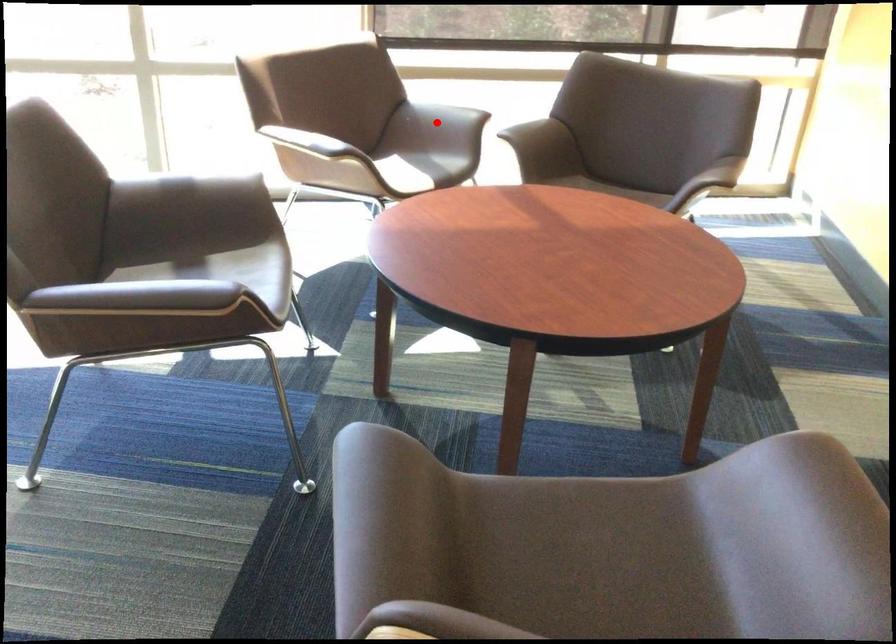
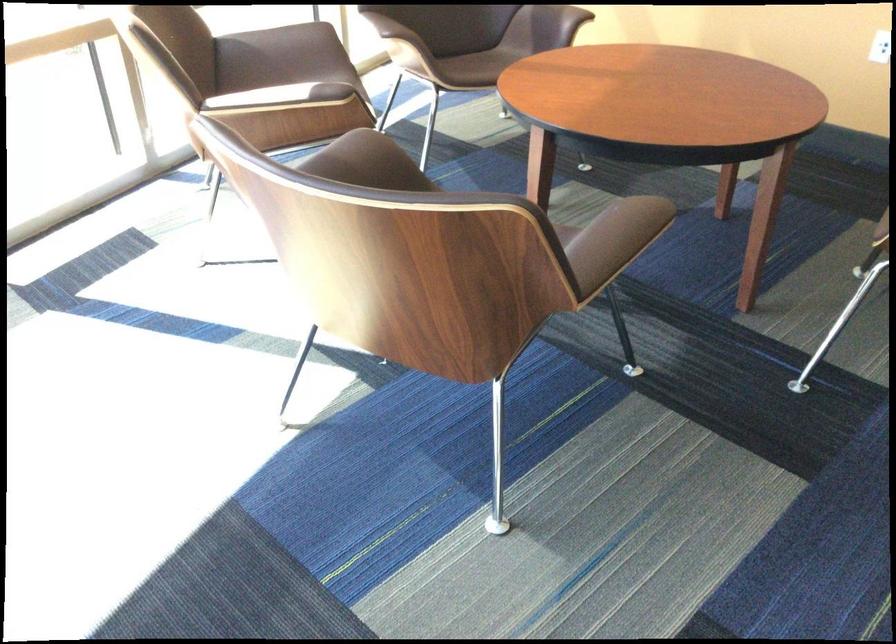
Question: I am providing you with two images of the same scene from different viewpoints. A red point is marked on the first image. At the location where the point appears in image 1, is it still visible in image 2?

Choices:
 (A) Yes
 (B) No

Answer: (A)